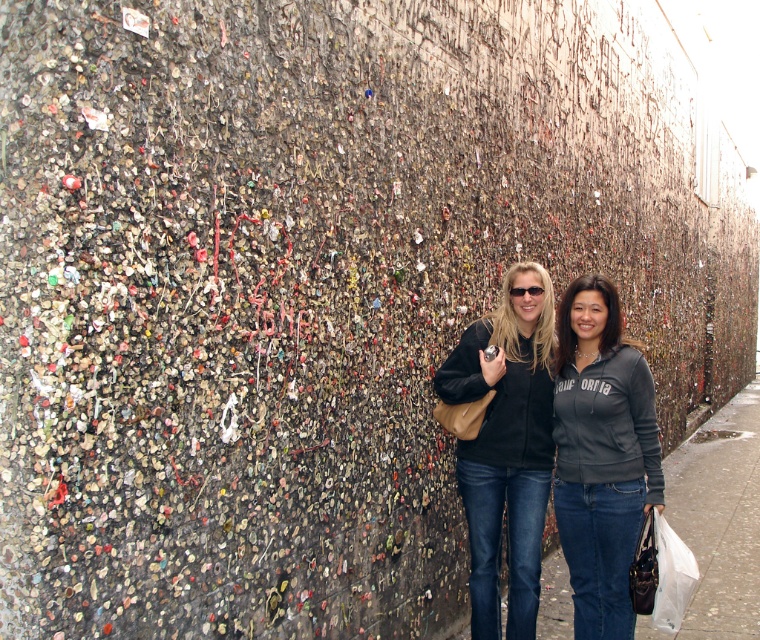
You are standing in the scene and want to place a small potted plant between the matte black jacket at center and the smooth concrete sidewalk at lower right. Based on their positions, will the plant be closer to the jacket or the sidewalk?

The matte black jacket at center is in front of the smooth concrete sidewalk at lower right, so the plant will be closer to the sidewalk since the jacket is positioned in front of it.